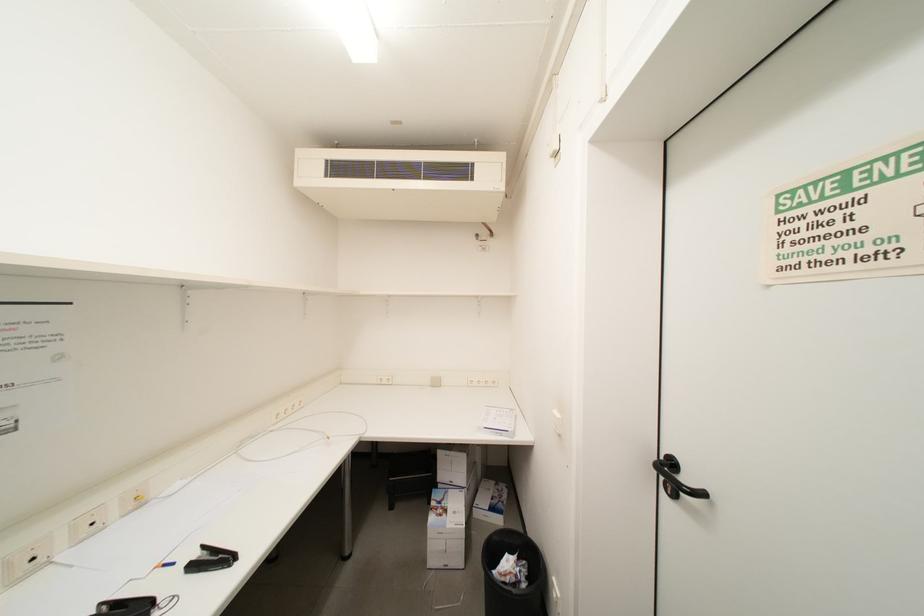
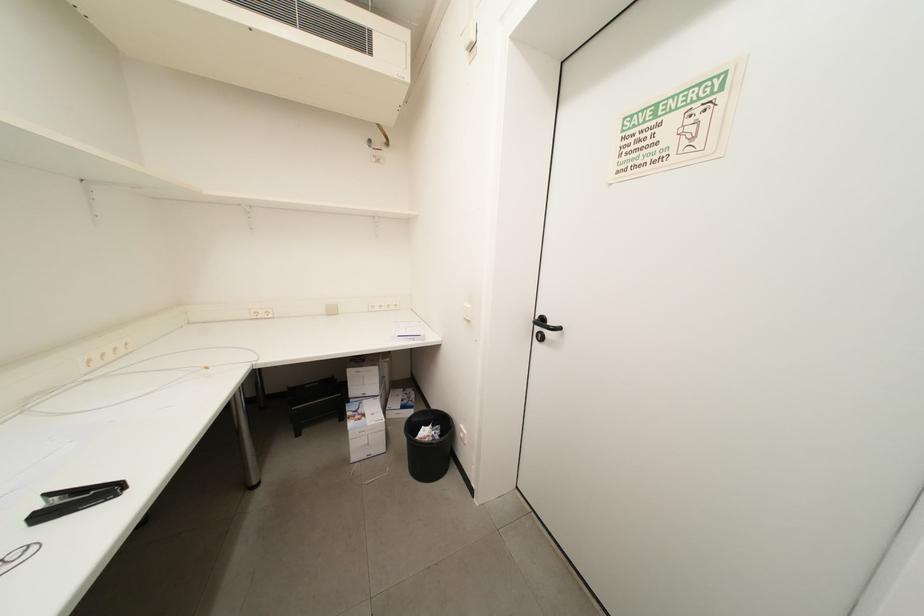
Question: The first image is from the beginning of the video and the second image is from the end. How did the camera likely rotate when shooting the video?

Choices:
 (A) Left
 (B) Right
 (C) Up
 (D) Down

Answer: (B)